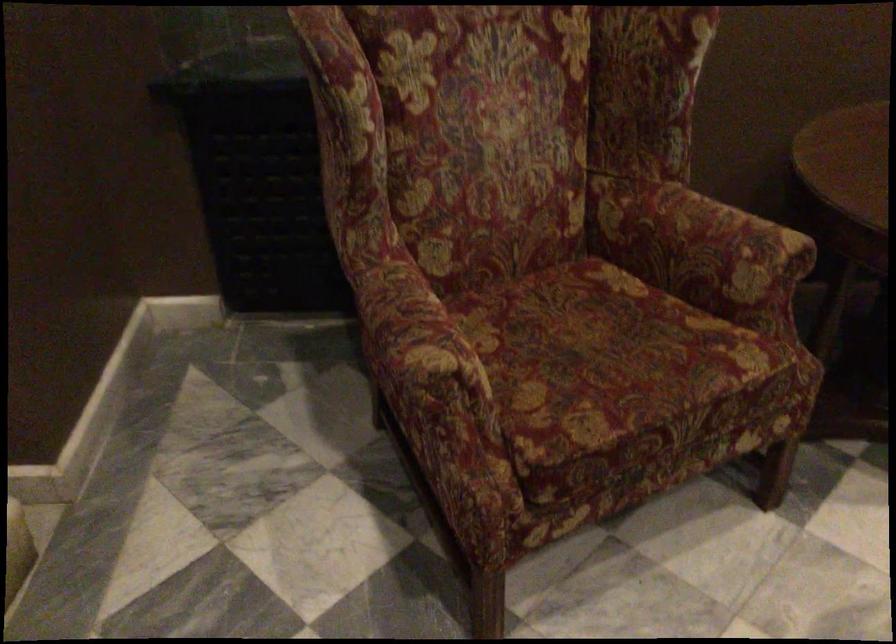
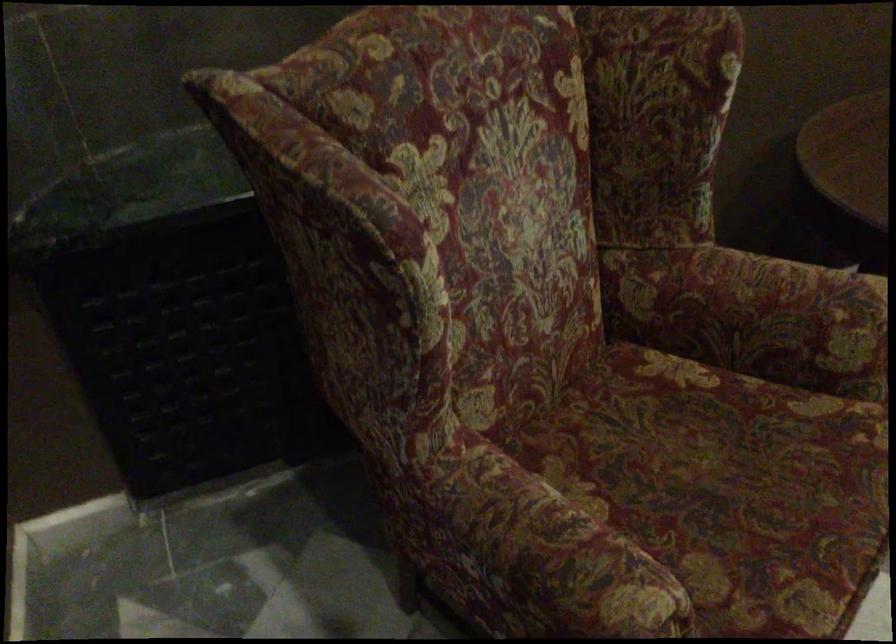
Where in the second image is the point corresponding to point 590,352 from the first image?

(726, 486)